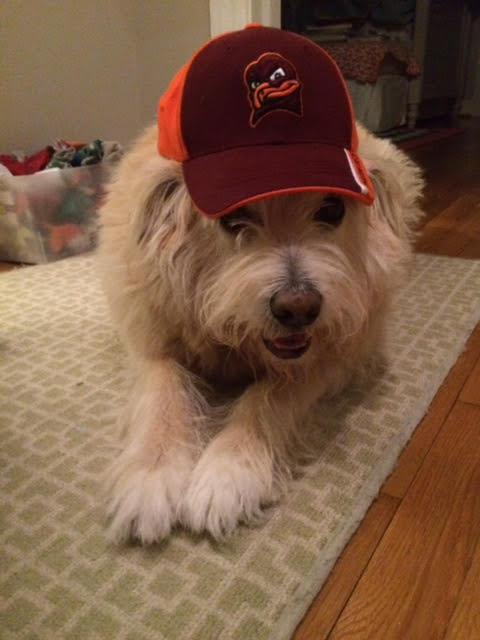
Locate an element on the screen. Image resolution: width=480 pixels, height=640 pixels. wall is located at coordinates (75, 52).